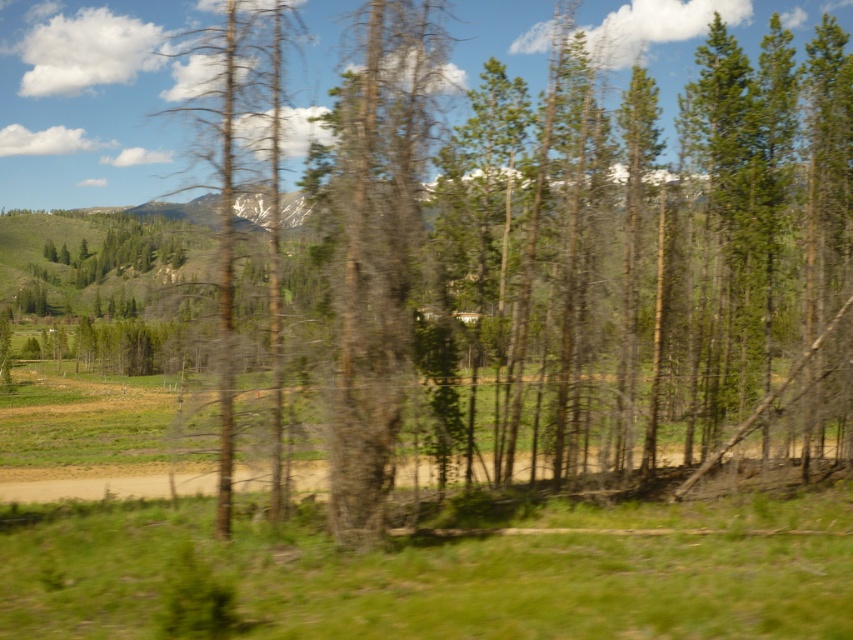
How distant is gray bark tree at center from brown dirt track at center?

The distance of gray bark tree at center from brown dirt track at center is 9.57 meters.

Locate an element on the screen. Image resolution: width=853 pixels, height=640 pixels. gray bark tree at center is located at coordinates (375, 250).

In order to click on gray bark tree at center in this screenshot , I will do coord(375,250).

Is brown dirt track at center thinner than dead bark tree at center?

No.

Is brown dirt track at center to the right of dead bark tree at center from the viewer's perspective?

Correct, you'll find brown dirt track at center to the right of dead bark tree at center.

Describe the element at coordinates (84, 483) in the screenshot. I see `brown dirt track at center` at that location.

The image size is (853, 640). I want to click on brown dirt track at center, so click(x=84, y=483).

Can you confirm if gray bark tree at center is positioned above dead bark tree at center?

Indeed, gray bark tree at center is positioned over dead bark tree at center.

Does point (403, 321) come farther from viewer compared to point (221, 257)?

That is False.

Find the location of a particular element. The width and height of the screenshot is (853, 640). gray bark tree at center is located at coordinates (375, 250).